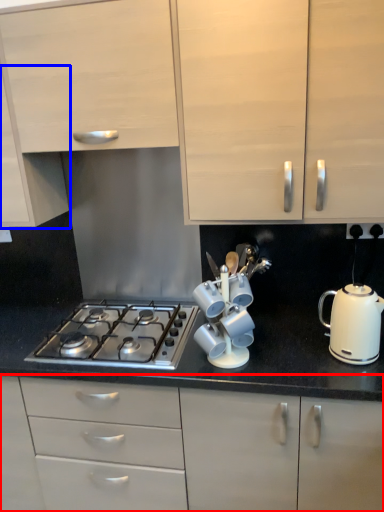
Question: Among these objects, which one is nearest to the camera, cabinetry (highlighted by a red box) or cabinetry (highlighted by a blue box)?

Choices:
 (A) cabinetry
 (B) cabinetry

Answer: (A)